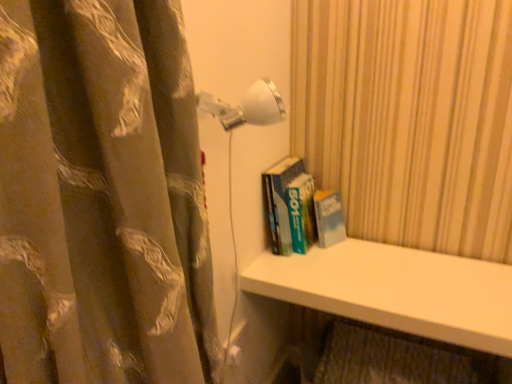
Locate an element on the screen. The image size is (512, 384). free region under hardcover book at center (from a real-world perspective) is located at coordinates click(x=313, y=255).